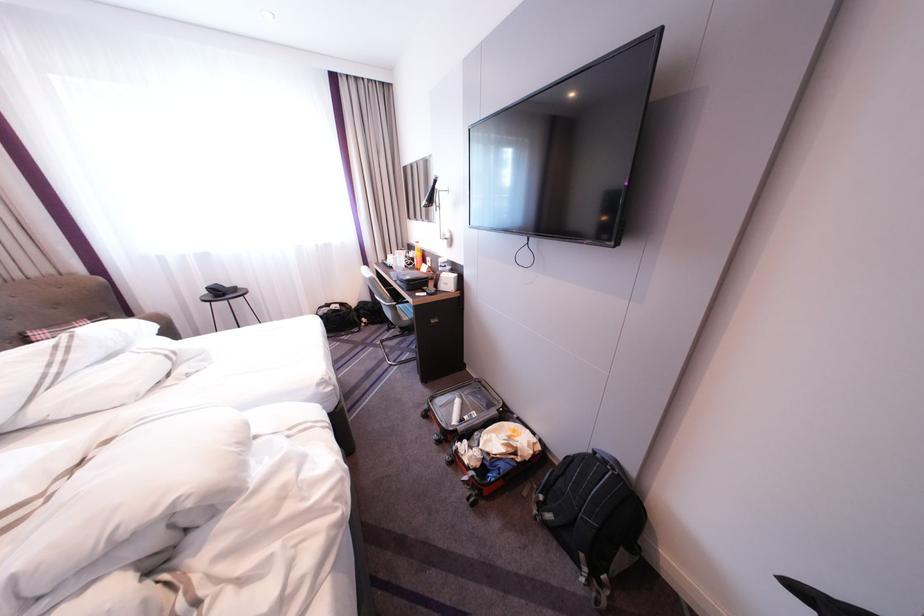
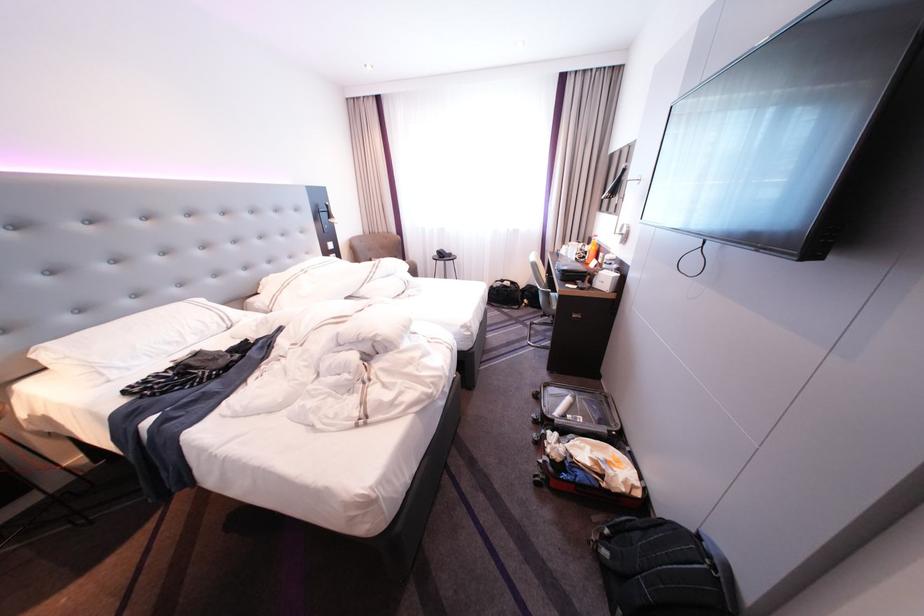
Locate, in the second image, the point that corresponds to the point at 391,330 in the first image.

(546, 314)